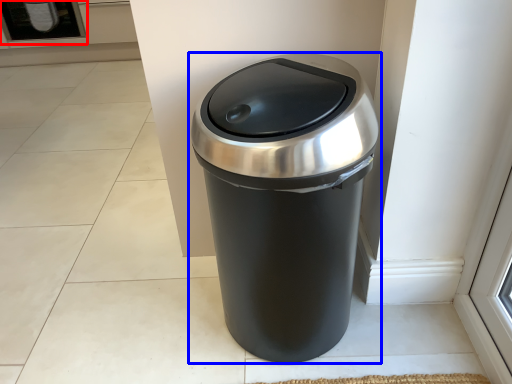
Question: Which of the following is the farthest to the observer, screen door (highlighted by a red box) or waste container (highlighted by a blue box)?

Choices:
 (A) screen door
 (B) waste container

Answer: (A)